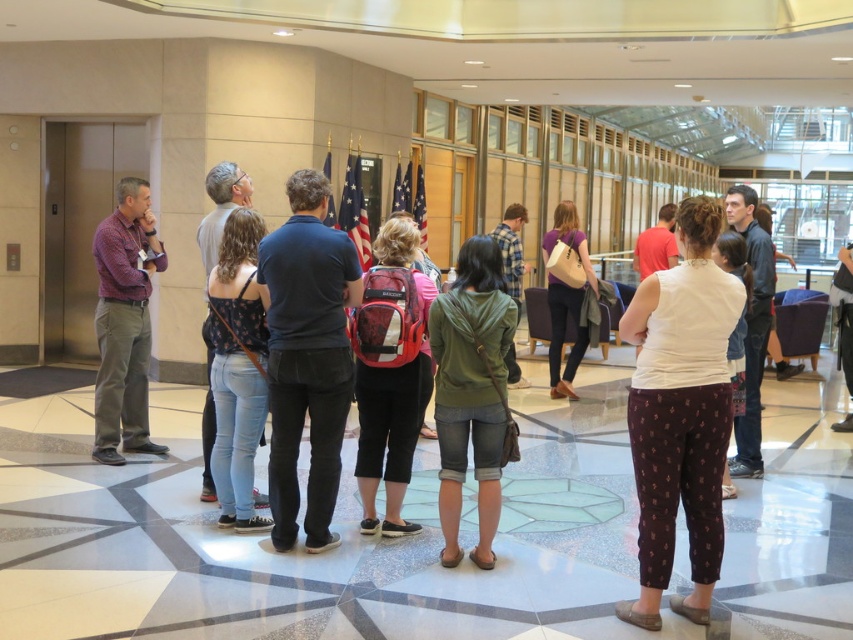
Can you confirm if red backpack at center is wider than purple matte shirt at center?

In fact, red backpack at center might be narrower than purple matte shirt at center.

Image resolution: width=853 pixels, height=640 pixels. I want to click on red backpack at center, so click(x=390, y=372).

The image size is (853, 640). Find the location of `red backpack at center`. red backpack at center is located at coordinates (390, 372).

Is point (325, 259) positioned before point (376, 396)?

That is True.

From the picture: Is dark blue cotton shirt at center wider than red backpack at center?

Indeed, dark blue cotton shirt at center has a greater width compared to red backpack at center.

What do you see at coordinates (306, 356) in the screenshot?
I see `dark blue cotton shirt at center` at bounding box center [306, 356].

Identify the location of dark blue cotton shirt at center. (306, 356).

From the picture: Between white cotton shirt at center and red backpack at center, which one is positioned higher?

Positioned higher is red backpack at center.

Does point (664, 488) come closer to viewer compared to point (408, 460)?

Yes, point (664, 488) is in front of point (408, 460).

Who is more forward, (648, 324) or (378, 472)?

Point (648, 324) is in front.

Locate an element on the screen. white cotton shirt at center is located at coordinates (680, 413).